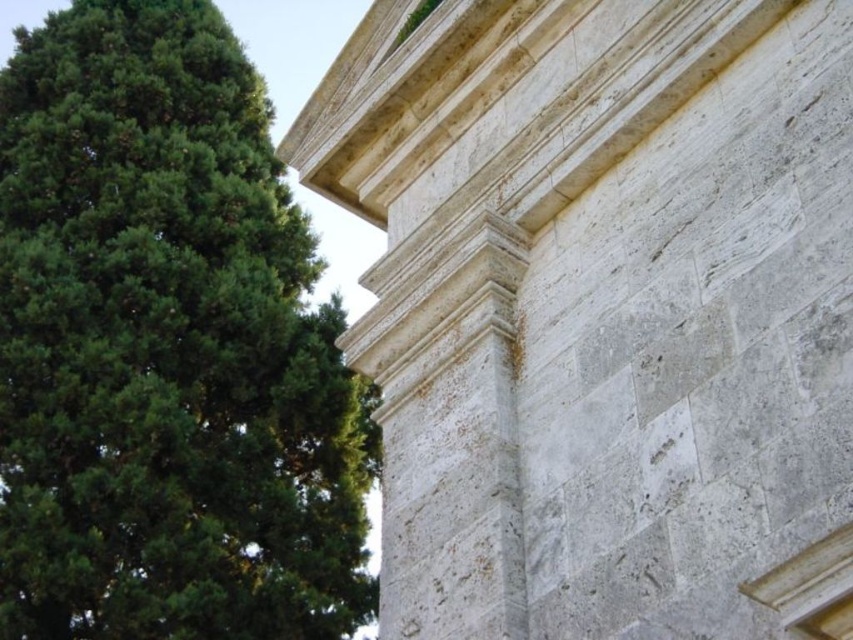
Can you confirm if white stone tower at upper right is positioned above green leafy tree at upper left?

Incorrect, white stone tower at upper right is not positioned above green leafy tree at upper left.

Is white stone tower at upper right to the left of green leafy tree at upper left from the viewer's perspective?

Incorrect, white stone tower at upper right is not on the left side of green leafy tree at upper left.

Is point (637, 180) more distant than point (51, 500)?

No, (637, 180) is in front of (51, 500).

Locate an element on the screen. white stone tower at upper right is located at coordinates (602, 310).